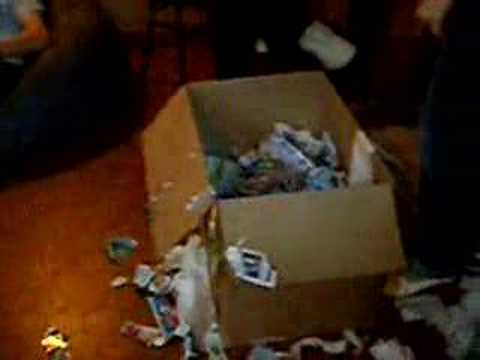
Locate an element on the screen. The height and width of the screenshot is (360, 480). light shining on floor is located at coordinates (51, 263), (67, 317), (94, 321).